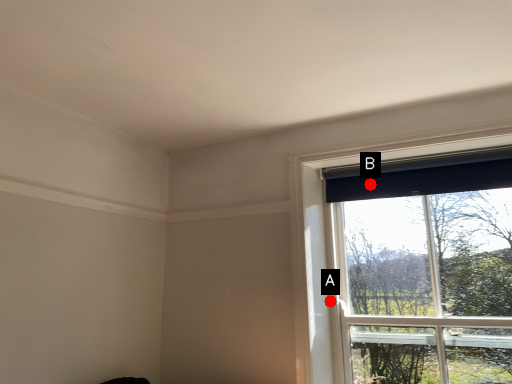
Question: Two points are circled on the image, labeled by A and B beside each circle. Which point is further to the camera?

Choices:
 (A) A is further
 (B) B is further

Answer: (A)